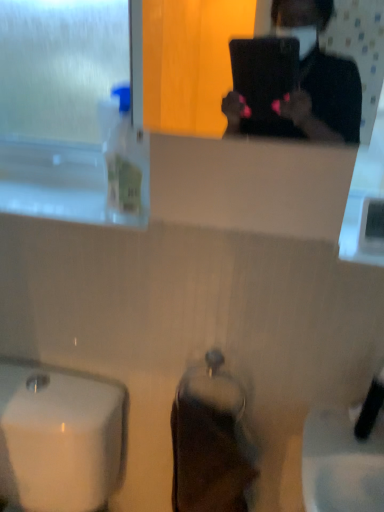
This screenshot has height=512, width=384. In order to click on frosted glass window screen at upper left in this screenshot , I will do coord(62,68).

The height and width of the screenshot is (512, 384). What do you see at coordinates (62, 68) in the screenshot? I see `frosted glass window screen at upper left` at bounding box center [62, 68].

Measure the distance between white glossy sink at lower left and camera.

→ white glossy sink at lower left is 37.01 inches away from camera.

The image size is (384, 512). What are the coordinates of `frosted glass window screen at upper left` in the screenshot? It's located at (62, 68).

Which object is further away from the camera, clear plastic bottle at left or black matte laptop at upper center?

clear plastic bottle at left.

Is clear plastic bottle at left at the right side of black matte laptop at upper center?

In fact, clear plastic bottle at left is to the left of black matte laptop at upper center.

Is clear plastic bottle at left taller than black matte laptop at upper center?

Incorrect, the height of clear plastic bottle at left is not larger of that of black matte laptop at upper center.

Which of these two, clear plastic bottle at left or black matte laptop at upper center, is thinner?

black matte laptop at upper center is thinner.

Is frosted glass window screen at upper left spatially inside white glossy sink at lower left, or outside of it?

frosted glass window screen at upper left is not enclosed by white glossy sink at lower left.

Is frosted glass window screen at upper left smaller than white glossy sink at lower left?

Indeed, frosted glass window screen at upper left has a smaller size compared to white glossy sink at lower left.

Is frosted glass window screen at upper left at the left side of white glossy sink at lower left?

No.

Between frosted glass window screen at upper left and white glossy sink at lower left, which one has less height?

With less height is frosted glass window screen at upper left.

This screenshot has height=512, width=384. In order to click on sink located on the left of black matte laptop at upper center in this screenshot , I will do `click(60, 438)`.

Which is in front, point (317, 22) or point (33, 443)?

The point (317, 22) is closer.

From a real-world perspective, is black matte laptop at upper center on top of white glossy sink at lower left?

Yes, from a real-world perspective, black matte laptop at upper center is over white glossy sink at lower left

Is black matte laptop at upper center aimed at white glossy sink at lower left?

No, black matte laptop at upper center does not turn towards white glossy sink at lower left.

Is clear plastic bottle at left positioned far away from frosted glass window screen at upper left?

No, clear plastic bottle at left is not far away from frosted glass window screen at upper left.

Who is shorter, clear plastic bottle at left or frosted glass window screen at upper left?

Standing shorter between the two is clear plastic bottle at left.

From the image's perspective, would you say clear plastic bottle at left is shown under frosted glass window screen at upper left?

Yes, from the image's perspective, clear plastic bottle at left is below frosted glass window screen at upper left.

Is frosted glass window screen at upper left far away from black matte laptop at upper center?

No, there isn't a large distance between frosted glass window screen at upper left and black matte laptop at upper center.

Is black matte laptop at upper center inside frosted glass window screen at upper left?

Definitely not — black matte laptop at upper center is not inside frosted glass window screen at upper left.

From a real-world perspective, is frosted glass window screen at upper left positioned over black matte laptop at upper center based on gravity?

No, from a real-world perspective, frosted glass window screen at upper left is not over black matte laptop at upper center

Which of these two, frosted glass window screen at upper left or black matte laptop at upper center, is thinner?

With smaller width is black matte laptop at upper center.

How many degrees apart are the facing directions of white glossy sink at lower left and frosted glass window screen at upper left?

1.99 degrees separate the facing orientations of white glossy sink at lower left and frosted glass window screen at upper left.

Which of these two, white glossy sink at lower left or frosted glass window screen at upper left, stands taller?

white glossy sink at lower left.

From the image's perspective, does white glossy sink at lower left appear lower than frosted glass window screen at upper left?

Yes.

Are white glossy sink at lower left and frosted glass window screen at upper left far apart?

Absolutely, white glossy sink at lower left is distant from frosted glass window screen at upper left.

In terms of height, does black matte laptop at upper center look taller or shorter compared to frosted glass window screen at upper left?

black matte laptop at upper center is shorter than frosted glass window screen at upper left.

This screenshot has height=512, width=384. I want to click on person that is in front of the frosted glass window screen at upper left, so click(x=310, y=104).

Would you say black matte laptop at upper center is inside or outside frosted glass window screen at upper left?

black matte laptop at upper center exists outside the volume of frosted glass window screen at upper left.

Locate an element on the screen. The width and height of the screenshot is (384, 512). window sill on the left of black matte laptop at upper center is located at coordinates (63, 183).

At what (x,y) coordinates should I click in order to perform the action: click on window screen that appears behind the white glossy sink at lower left. Please return your answer as a coordinate pair (x, y). This screenshot has width=384, height=512. Looking at the image, I should click on (62, 68).

From the image, which object appears to be nearer to clear plastic bottle at left, black matte laptop at upper center or white glossy sink at lower left?

white glossy sink at lower left lies closer to clear plastic bottle at left than the other object.

In the scene shown: Estimate the real-world distances between objects in this image. Which object is further from frosted glass window screen at upper left, white glossy sink at lower left or clear plastic bottle at left?

The object further to frosted glass window screen at upper left is white glossy sink at lower left.

From the image, which object appears to be farther from black matte laptop at upper center, frosted glass window screen at upper left or white glossy sink at lower left?

white glossy sink at lower left is further to black matte laptop at upper center.

Looking at the image, which one is located closer to black matte laptop at upper center, clear plastic bottle at left or white glossy sink at lower left?

clear plastic bottle at left lies closer to black matte laptop at upper center than the other object.

Which object lies further to the anchor point white glossy sink at lower left, clear plastic bottle at left or black matte laptop at upper center?

black matte laptop at upper center.

Estimate the real-world distances between objects in this image. Which object is closer to white glossy sink at lower left, frosted glass window screen at upper left or black matte laptop at upper center?

Based on the image, black matte laptop at upper center appears to be nearer to white glossy sink at lower left.

Considering their positions, is black matte laptop at upper center positioned closer to white glossy sink at lower left than clear plastic bottle at left?

clear plastic bottle at left is positioned closer to the anchor white glossy sink at lower left.

Looking at the image, which one is located further to frosted glass window screen at upper left, black matte laptop at upper center or white glossy sink at lower left?

white glossy sink at lower left is positioned further to the anchor frosted glass window screen at upper left.

Locate an element on the screen. window sill situated between frosted glass window screen at upper left and black matte laptop at upper center from left to right is located at coordinates (63, 183).

Where is `window sill between frosted glass window screen at upper left and white glossy sink at lower left vertically`? The height and width of the screenshot is (512, 384). window sill between frosted glass window screen at upper left and white glossy sink at lower left vertically is located at coordinates (63, 183).

Locate an element on the screen. The width and height of the screenshot is (384, 512). person between frosted glass window screen at upper left and white glossy sink at lower left in the up-down direction is located at coordinates (310, 104).

Where is `window sill between black matte laptop at upper center and white glossy sink at lower left vertically`? The image size is (384, 512). window sill between black matte laptop at upper center and white glossy sink at lower left vertically is located at coordinates (63, 183).